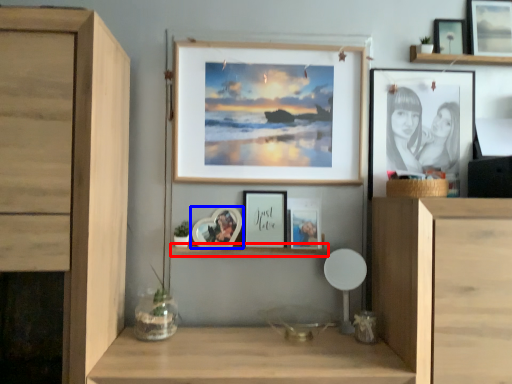
Question: Which of the following is the farthest to the observer, shelf (highlighted by a red box) or picture frame (highlighted by a blue box)?

Choices:
 (A) shelf
 (B) picture frame

Answer: (A)